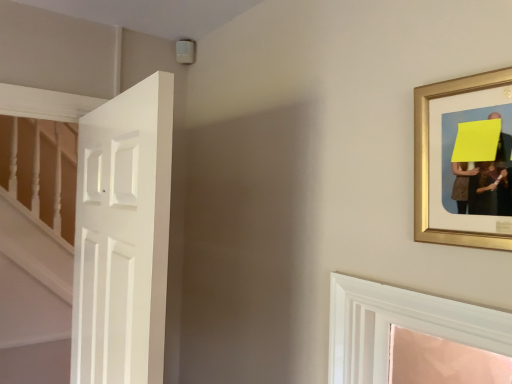
Question: Is gold framed picture at upper right looking in the opposite direction of white matte door at left?

Choices:
 (A) yes
 (B) no

Answer: (B)

Question: Does gold framed picture at upper right turn towards white matte door at left?

Choices:
 (A) yes
 (B) no

Answer: (B)

Question: Is gold framed picture at upper right taller than white matte door at left?

Choices:
 (A) yes
 (B) no

Answer: (B)

Question: Is gold framed picture at upper right beside white matte door at left?

Choices:
 (A) no
 (B) yes

Answer: (A)

Question: Is gold framed picture at upper right behind white matte door at left?

Choices:
 (A) yes
 (B) no

Answer: (B)

Question: Is gold framed picture at upper right at the right side of white matte door at left?

Choices:
 (A) no
 (B) yes

Answer: (B)

Question: From the image's perspective, is white matte door at left below gold framed picture at upper right?

Choices:
 (A) yes
 (B) no

Answer: (A)

Question: Considering the relative sizes of white matte door at left and gold framed picture at upper right in the image provided, is white matte door at left shorter than gold framed picture at upper right?

Choices:
 (A) yes
 (B) no

Answer: (B)

Question: From a real-world perspective, is white matte door at left on gold framed picture at upper right?

Choices:
 (A) yes
 (B) no

Answer: (B)

Question: Is white matte door at left smaller than gold framed picture at upper right?

Choices:
 (A) yes
 (B) no

Answer: (B)

Question: Can you confirm if white matte door at left is thinner than gold framed picture at upper right?

Choices:
 (A) no
 (B) yes

Answer: (A)

Question: From the image's perspective, does white matte door at left appear higher than gold framed picture at upper right?

Choices:
 (A) yes
 (B) no

Answer: (B)

Question: From the image's perspective, is white matte door at left located above or below gold framed picture at upper right?

Choices:
 (A) above
 (B) below

Answer: (B)